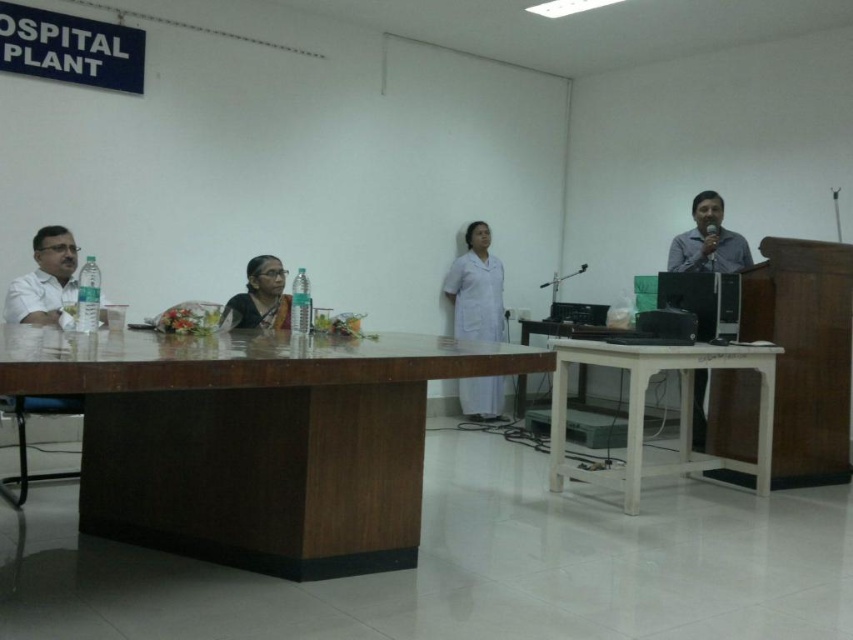
Question: Is white cloth at center further to the viewer compared to satin black saree at center?

Choices:
 (A) no
 (B) yes

Answer: (B)

Question: Which point appears farthest from the camera in this image?

Choices:
 (A) (103, 355)
 (B) (486, 417)
 (C) (695, 253)

Answer: (B)

Question: Is white cloth at center positioned before matte gray shirt at right?

Choices:
 (A) no
 (B) yes

Answer: (A)

Question: Does white cloth at center appear over matte gray shirt at right?

Choices:
 (A) yes
 (B) no

Answer: (B)

Question: Based on their relative distances, which object is farther from the matte gray shirt at right?

Choices:
 (A) brown wood table at center
 (B) white wooden table at right
 (C) white cloth at center
 (D) satin black saree at center

Answer: (A)

Question: Which of the following is the closest to the observer?

Choices:
 (A) (270, 323)
 (B) (688, 264)
 (C) (108, 340)

Answer: (C)